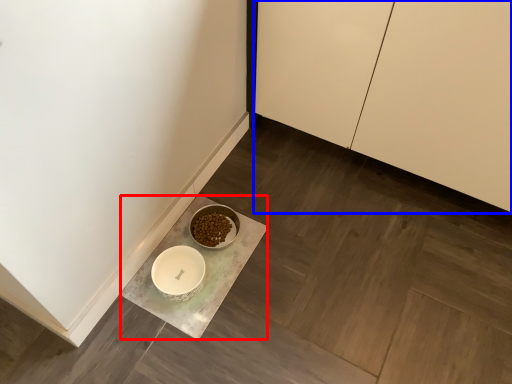
Question: Among these objects, which one is nearest to the camera, counter (highlighted by a red box) or cabinetry (highlighted by a blue box)?

Choices:
 (A) counter
 (B) cabinetry

Answer: (B)